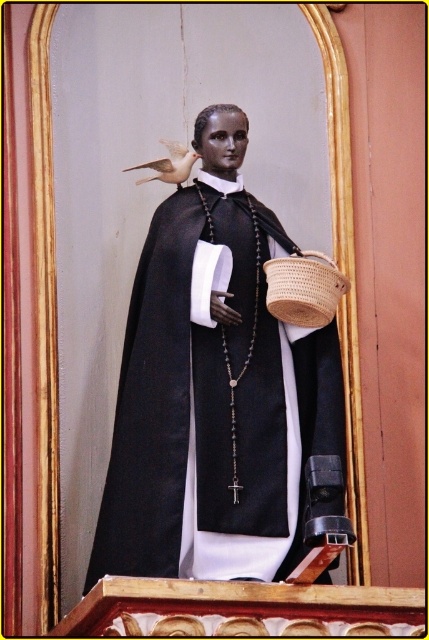
Question: Observing the image, what is the correct spatial positioning of woven brown basket at lower right in reference to matte white bird at upper left?

Choices:
 (A) above
 (B) below

Answer: (B)

Question: Among these points, which one is nearest to the camera?

Choices:
 (A) (211, 310)
 (B) (181, 161)
 (C) (329, 268)

Answer: (C)

Question: Is the position of matte black statue at center less distant than that of matte white bird at upper left?

Choices:
 (A) no
 (B) yes

Answer: (B)

Question: Which point is closer to the camera?

Choices:
 (A) (323, 300)
 (B) (211, 417)

Answer: (B)

Question: Considering the relative positions of matte black statue at center and matte white bird at upper left in the image provided, where is matte black statue at center located with respect to matte white bird at upper left?

Choices:
 (A) above
 (B) below

Answer: (B)

Question: Estimate the real-world distances between objects in this image. Which object is closer to the matte black statue at center?

Choices:
 (A) woven brown basket at lower right
 (B) matte white bird at upper left

Answer: (A)